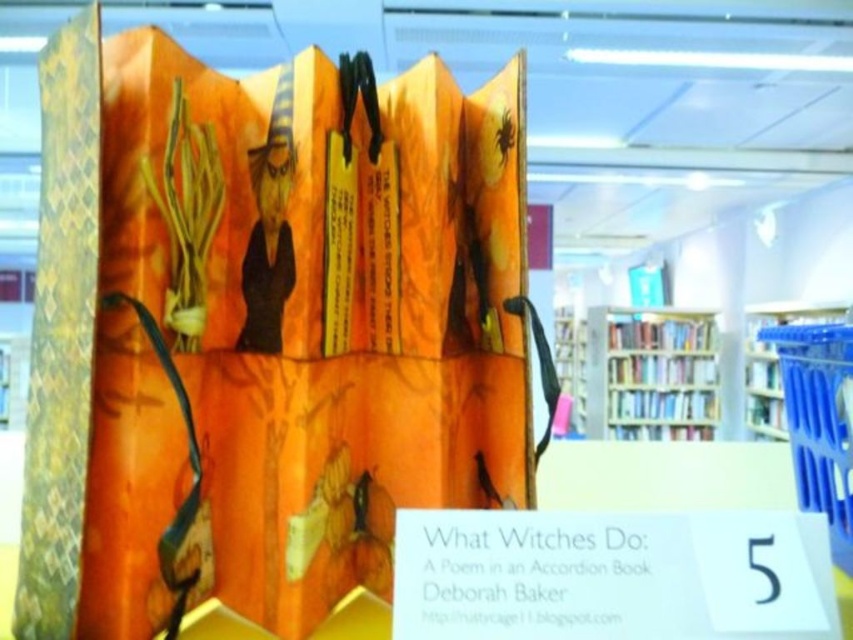
You are organizing a Halloween display and have a yellow woven fabric at left and a blue plastic bookshelf at right. Which item is narrower?

The yellow woven fabric at left has a lesser width compared to the blue plastic bookshelf at right, so the yellow woven fabric at left is narrower.

You are a librarian who wants to place a decorative item on the yellow woven fabric at left and the wooden bookshelf at center. Which surface is closer to you where you can easily reach without moving your position?

The yellow woven fabric at left is closer to the viewer than the wooden bookshelf at center, so you can easily reach it without moving your position.

You are a librarian organizing the library. You see the yellow woven fabric at left and the blue plastic bookshelf at right. Which object is nearer to you?

The yellow woven fabric at left is closer to the viewer than the blue plastic bookshelf at right.